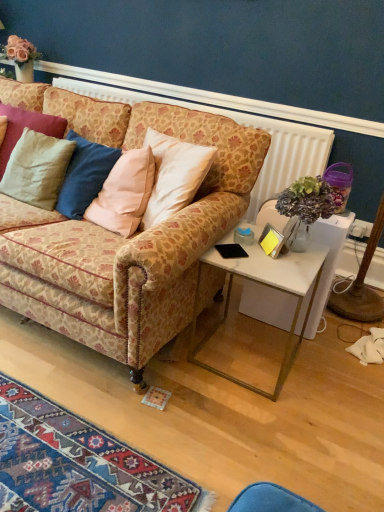
Question: From the image's perspective, is matte beige pillow at left, positioned as the 1th pillow in bottom-to-top order, under matte beige pillow at left, the 2th pillow positioned from the bottom?

Choices:
 (A) yes
 (B) no

Answer: (A)

Question: Is matte beige pillow at left, positioned as the 1th pillow in bottom-to-top order, positioned in front of matte beige pillow at left, the 2th pillow positioned from the bottom?

Choices:
 (A) no
 (B) yes

Answer: (B)

Question: Can you confirm if matte beige pillow at left, the second pillow from the top, is thinner than matte beige pillow at left, which appears as the 1th pillow when viewed from the top?

Choices:
 (A) no
 (B) yes

Answer: (B)

Question: Does matte beige pillow at left, the second pillow from the top, have a larger size compared to matte beige pillow at left, which appears as the 1th pillow when viewed from the top?

Choices:
 (A) no
 (B) yes

Answer: (B)

Question: Is matte beige pillow at left, positioned as the 1th pillow in bottom-to-top order, outside of matte beige pillow at left, which appears as the 1th pillow when viewed from the top?

Choices:
 (A) no
 (B) yes

Answer: (B)

Question: Looking at their shapes, would you say white marble side table at right is wider or thinner than white marble desk at right?

Choices:
 (A) wide
 (B) thin

Answer: (A)

Question: Is point (296, 347) closer or farther from the camera than point (327, 229)?

Choices:
 (A) farther
 (B) closer

Answer: (B)

Question: Is white marble side table at right inside the boundaries of white marble desk at right, or outside?

Choices:
 (A) inside
 (B) outside

Answer: (B)

Question: Based on their sizes in the image, would you say white marble side table at right is bigger or smaller than white marble desk at right?

Choices:
 (A) big
 (B) small

Answer: (A)

Question: Considering the positions of point (36, 153) and point (246, 305), is point (36, 153) closer or farther from the camera than point (246, 305)?

Choices:
 (A) closer
 (B) farther

Answer: (A)

Question: From the image's perspective, is matte beige pillow at left, positioned as the 1th pillow in bottom-to-top order, above or below white marble desk at right?

Choices:
 (A) below
 (B) above

Answer: (B)

Question: Which is correct: matte beige pillow at left, positioned as the 1th pillow in bottom-to-top order, is inside white marble desk at right, or outside of it?

Choices:
 (A) outside
 (B) inside

Answer: (A)

Question: Considering the positions of matte beige pillow at left, the second pillow from the top, and white marble desk at right in the image, is matte beige pillow at left, the second pillow from the top, wider or thinner than white marble desk at right?

Choices:
 (A) wide
 (B) thin

Answer: (B)

Question: Considering the positions of matte beige pillow at left, the 2th pillow positioned from the bottom, and patterned fabric couch at center in the image, is matte beige pillow at left, the 2th pillow positioned from the bottom, wider or thinner than patterned fabric couch at center?

Choices:
 (A) thin
 (B) wide

Answer: (A)

Question: Does point (16, 118) appear closer or farther from the camera than point (86, 330)?

Choices:
 (A) farther
 (B) closer

Answer: (A)